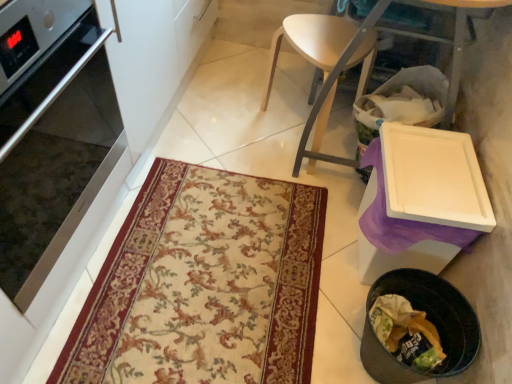
This screenshot has width=512, height=384. I want to click on free area in between satin silver oven at left and black plastic trash can at lower right, so click(x=219, y=298).